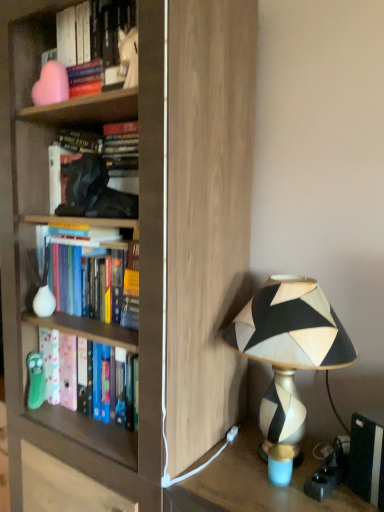
Where is `hardcover books at center left, which is the second book from bottom to top`? The image size is (384, 512). hardcover books at center left, which is the second book from bottom to top is located at coordinates (74, 263).

This screenshot has width=384, height=512. What do you see at coordinates (74, 263) in the screenshot? I see `hardcover books at center left, which is the 3th book in top-to-bottom order` at bounding box center [74, 263].

Identify the location of hardcover book at center, the 2th book from the top. (98, 174).

Locate an element on the screen. This screenshot has height=512, width=384. hardcover books at center left, which is the 3th book in top-to-bottom order is located at coordinates (74, 263).

Can we say black matte book at lower right lies outside pink matte vase at upper left, which appears as the 4th book when ordered from the bottom?

Yes, black matte book at lower right is not within pink matte vase at upper left, which appears as the 4th book when ordered from the bottom.

Is black matte book at lower right taller than pink matte vase at upper left, which appears as the 4th book when ordered from the bottom?

In fact, black matte book at lower right may be shorter than pink matte vase at upper left, which appears as the 4th book when ordered from the bottom.

Is black matte book at lower right facing towards pink matte vase at upper left, which appears as the 4th book when ordered from the bottom?

No, black matte book at lower right is not facing towards pink matte vase at upper left, which appears as the 4th book when ordered from the bottom.

Based on the photo, is black matte book at lower right in front of or behind pink matte vase at upper left, which appears as the 4th book when ordered from the bottom, in the image?

Visually, black matte book at lower right is located in front of pink matte vase at upper left, which appears as the 4th book when ordered from the bottom.

Considering their positions, is black matte book at lower right located in front of or behind geometric-patterned lampshade at right?

Visually, black matte book at lower right is located behind geometric-patterned lampshade at right.

Considering the sizes of objects black matte book at lower right and geometric-patterned lampshade at right in the image provided, who is taller, black matte book at lower right or geometric-patterned lampshade at right?

geometric-patterned lampshade at right is taller.

Is black matte book at lower right inside the boundaries of geometric-patterned lampshade at right, or outside?

black matte book at lower right cannot be found inside geometric-patterned lampshade at right.

You are a GUI agent. You are given a task and a screenshot of the screen. Output one action in this format:
    pyautogui.click(x=<x>, y=<y>)
    Task: Click on the lamp above the black matte book at lower right (from a real-world perspective)
    The image size is (384, 512).
    Given the screenshot: What is the action you would take?
    pyautogui.click(x=288, y=348)

Is pink matte vase at upper left, marked as the first book in a top-to-bottom arrangement, taller than matte wood bookcase at center?

No, pink matte vase at upper left, marked as the first book in a top-to-bottom arrangement, is not taller than matte wood bookcase at center.

From a real-world perspective, is pink matte vase at upper left, marked as the first book in a top-to-bottom arrangement, physically below matte wood bookcase at center?

Incorrect, from a real-world perspective, pink matte vase at upper left, marked as the first book in a top-to-bottom arrangement, is higher than matte wood bookcase at center.

Which object is wider, pink matte vase at upper left, which appears as the 4th book when ordered from the bottom, or matte wood bookcase at center?

matte wood bookcase at center is wider.

Are pink matte vase at upper left, which appears as the 4th book when ordered from the bottom, and matte wood bookcase at center beside each other?

No.

Where is `book behind the hardcover books at center left, which is the second book from bottom to top`? book behind the hardcover books at center left, which is the second book from bottom to top is located at coordinates (67, 368).

How much distance is there between hardcover books at left, the first book when ordered from bottom to top, and hardcover books at center left, which is the second book from bottom to top?

hardcover books at left, the first book when ordered from bottom to top, and hardcover books at center left, which is the second book from bottom to top, are 8.78 inches apart from each other.

Is point (87, 393) positioned before point (67, 241)?

No, it is not.

From the image's perspective, is hardcover books at left, the first book when ordered from bottom to top, under hardcover books at center left, which is the second book from bottom to top?

Correct, hardcover books at left, the first book when ordered from bottom to top, appears lower than hardcover books at center left, which is the second book from bottom to top, in the image.

Looking at this image, what's the angular difference between matte wood bookcase at center and hardcover book at center, the 3th book in the bottom-to-top sequence,'s facing directions?

There is a 0.131-degree angle between the facing directions of matte wood bookcase at center and hardcover book at center, the 3th book in the bottom-to-top sequence.

Identify the location of bookcase below the hardcover book at center, the 3th book in the bottom-to-top sequence (from a real-world perspective). (144, 241).

Considering the positions of point (30, 202) and point (52, 146), is point (30, 202) closer or farther from the camera than point (52, 146)?

Point (30, 202) is closer to the camera than point (52, 146).

Is matte wood bookcase at center inside the boundaries of hardcover book at center, the 3th book in the bottom-to-top sequence, or outside?

matte wood bookcase at center is not enclosed by hardcover book at center, the 3th book in the bottom-to-top sequence.

Could you tell me if hardcover books at center left, which is the 3th book in top-to-bottom order, is facing pink matte vase at upper left, which appears as the 4th book when ordered from the bottom?

No, hardcover books at center left, which is the 3th book in top-to-bottom order, is not facing towards pink matte vase at upper left, which appears as the 4th book when ordered from the bottom.

Which is behind, hardcover books at center left, which is the second book from bottom to top, or pink matte vase at upper left, which appears as the 4th book when ordered from the bottom?

hardcover books at center left, which is the second book from bottom to top, is further from the camera.

Considering the relative positions of hardcover books at center left, which is the second book from bottom to top, and pink matte vase at upper left, marked as the first book in a top-to-bottom arrangement, in the image provided, is hardcover books at center left, which is the second book from bottom to top, to the left of pink matte vase at upper left, marked as the first book in a top-to-bottom arrangement, from the viewer's perspective?

In fact, hardcover books at center left, which is the second book from bottom to top, is to the right of pink matte vase at upper left, marked as the first book in a top-to-bottom arrangement.

How many degrees apart are the facing directions of hardcover books at center left, which is the 3th book in top-to-bottom order, and pink matte vase at upper left, which appears as the 4th book when ordered from the bottom?

hardcover books at center left, which is the 3th book in top-to-bottom order, and pink matte vase at upper left, which appears as the 4th book when ordered from the bottom, are facing 0.000341 degrees away from each other.

What are the coordinates of `the 2nd book to the left when counting from the matte wood bookcase at center` in the screenshot? It's located at (74, 263).

Is matte wood bookcase at center looking in the opposite direction of hardcover books at center left, which is the second book from bottom to top?

Yes, hardcover books at center left, which is the second book from bottom to top, is at the back of matte wood bookcase at center.

Between matte wood bookcase at center and hardcover books at center left, which is the 3th book in top-to-bottom order, which one has smaller size?

With smaller size is hardcover books at center left, which is the 3th book in top-to-bottom order.

Is point (185, 47) closer to viewer compared to point (79, 264)?

Yes, point (185, 47) is closer to viewer.

The image size is (384, 512). Find the location of `paperback book in front of the pink matte vase at upper left, marked as the first book in a top-to-bottom arrangement`. paperback book in front of the pink matte vase at upper left, marked as the first book in a top-to-bottom arrangement is located at coordinates (366, 460).

You are a GUI agent. You are given a task and a screenshot of the screen. Output one action in this format:
    pyautogui.click(x=<x>, y=<y>)
    Task: Click on the paperback book located below the geometric-patterned lampshade at right (from the image's perspective)
    The width and height of the screenshot is (384, 512).
    Given the screenshot: What is the action you would take?
    pyautogui.click(x=366, y=460)

Which object lies further to the anchor point pink matte vase at upper left, which appears as the 4th book when ordered from the bottom, hardcover books at center left, which is the 3th book in top-to-bottom order, or black matte book at lower right?

black matte book at lower right is positioned further to the anchor pink matte vase at upper left, which appears as the 4th book when ordered from the bottom.

Considering their positions, is geometric-patterned lampshade at right positioned further to black matte book at lower right than hardcover book at center, the 3th book in the bottom-to-top sequence?

hardcover book at center, the 3th book in the bottom-to-top sequence, is further to black matte book at lower right.

Looking at the image, which one is located further to black matte book at lower right, hardcover book at center, the 2th book from the top, or hardcover books at center left, which is the 3th book in top-to-bottom order?

hardcover book at center, the 2th book from the top.

Which object lies nearer to the anchor point black matte book at lower right, matte wood bookcase at center or hardcover book at center, the 3th book in the bottom-to-top sequence?

Among the two, matte wood bookcase at center is located nearer to black matte book at lower right.

When comparing their distances from matte wood bookcase at center, does hardcover book at center, the 2th book from the top, or pink matte vase at upper left, marked as the first book in a top-to-bottom arrangement, seem closer?

hardcover book at center, the 2th book from the top, lies closer to matte wood bookcase at center than the other object.

When comparing their distances from pink matte vase at upper left, marked as the first book in a top-to-bottom arrangement, does hardcover books at left, the first book when ordered from bottom to top, or hardcover book at center, the 3th book in the bottom-to-top sequence, seem closer?

hardcover book at center, the 3th book in the bottom-to-top sequence, lies closer to pink matte vase at upper left, marked as the first book in a top-to-bottom arrangement, than the other object.

Estimate the real-world distances between objects in this image. Which object is further from matte wood bookcase at center, hardcover book at center, the 2th book from the top, or geometric-patterned lampshade at right?

Result: geometric-patterned lampshade at right.

From the image, which object appears to be nearer to hardcover book at center, the 3th book in the bottom-to-top sequence, black matte book at lower right or pink matte vase at upper left, marked as the first book in a top-to-bottom arrangement?

pink matte vase at upper left, marked as the first book in a top-to-bottom arrangement, is closer to hardcover book at center, the 3th book in the bottom-to-top sequence.

Where is `lamp between pink matte vase at upper left, marked as the first book in a top-to-bottom arrangement, and black matte book at lower right, in the vertical direction`? The width and height of the screenshot is (384, 512). lamp between pink matte vase at upper left, marked as the first book in a top-to-bottom arrangement, and black matte book at lower right, in the vertical direction is located at coordinates (288, 348).

Image resolution: width=384 pixels, height=512 pixels. Identify the location of lamp between hardcover books at left, the 4th book positioned from the top, and black matte book at lower right, in the horizontal direction. (288, 348).

Locate an element on the screen. bookcase between hardcover book at center, the 3th book in the bottom-to-top sequence, and black matte book at lower right is located at coordinates (144, 241).

Locate an element on the screen. This screenshot has width=384, height=512. lamp between hardcover books at center left, which is the second book from bottom to top, and black matte book at lower right, in the horizontal direction is located at coordinates (288, 348).